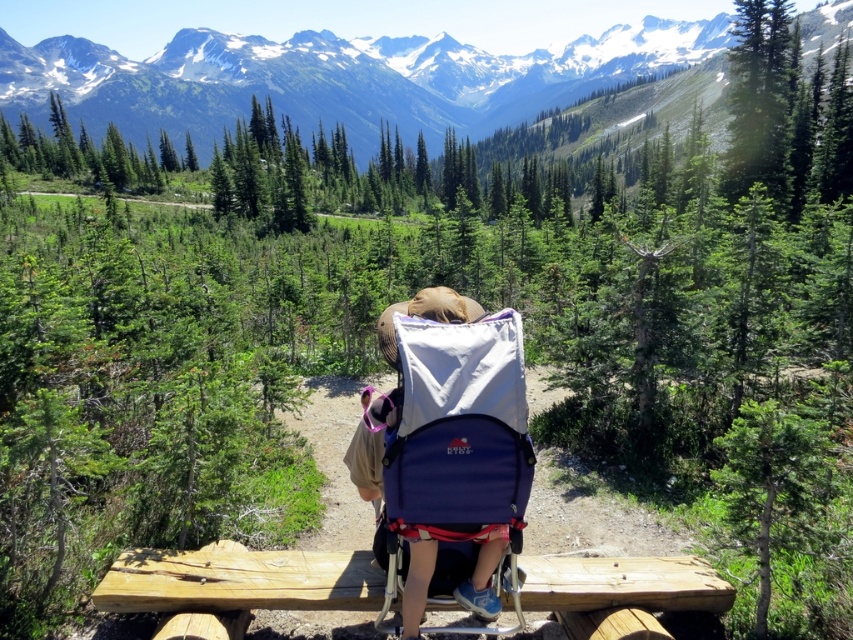
Looking at this image, you are a photographer trying to capture the snowy granite mountains at upper center in your shot. You notice that the mountains are slightly out of frame. To center them, should you move your camera left or right? Please explain using their coordinates.

The snowy granite mountains at upper center are located at coordinates point 0.122 on the x and 0.399 on the y. Since the x coordinate is less than 0.5, the mountains are to the left side of the image. To center them, move the camera to the right so the mountains shift towards the center.

You are a photographer planning to take a landscape photo of the snowy granite mountains at upper center and the blue fabric baby carriage at center. Which object should you focus on first if you want to capture both in a single frame without moving the camera?

You should focus on the snowy granite mountains at upper center first because it is larger in size than the blue fabric baby carriage at center, allowing you to frame the composition effectively.